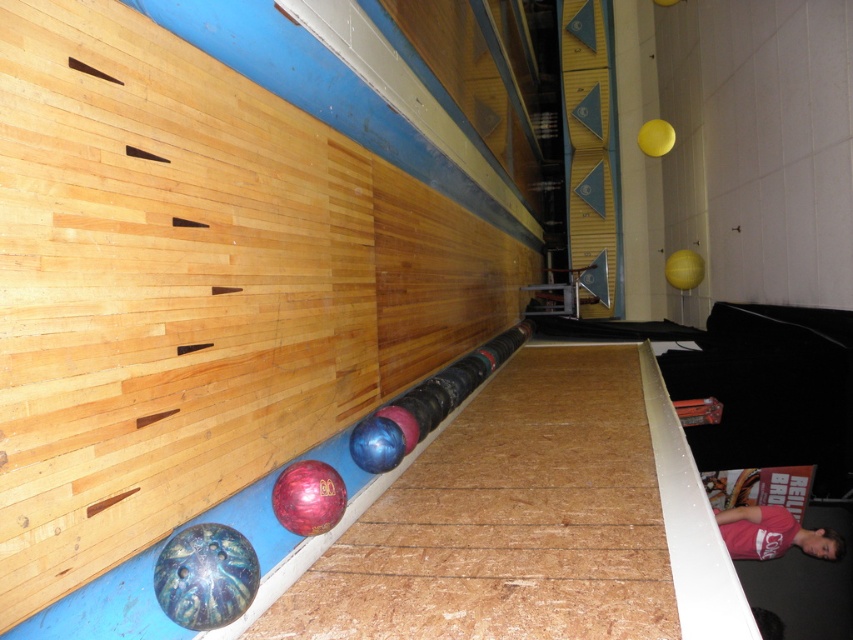
Can you confirm if shiny pink bowling ball at lower center is positioned to the right of blue glossy bowling ball at center?

No, shiny pink bowling ball at lower center is not to the right of blue glossy bowling ball at center.

Based on the photo, is shiny pink bowling ball at lower center thinner than blue glossy bowling ball at center?

Incorrect, shiny pink bowling ball at lower center's width is not less than blue glossy bowling ball at center's.

At what (x,y) coordinates should I click in order to perform the action: click on shiny pink bowling ball at lower center. Please return your answer as a coordinate pair (x, y). Looking at the image, I should click on (308, 497).

Is shiny blue bowling ball at lower left closer to camera compared to shiny pink bowling ball at lower center?

Yes.

Which is in front, point (177, 547) or point (282, 470)?

Point (177, 547) is more forward.

Does point (231, 529) lie behind point (323, 476)?

That is False.

Identify the location of shiny blue bowling ball at lower left. Image resolution: width=853 pixels, height=640 pixels. (206, 577).

Locate an element on the screen. shiny blue bowling ball at lower left is located at coordinates (206, 577).

Which is above, shiny blue bowling ball at lower left or blue glossy bowling ball at center?

Positioned higher is blue glossy bowling ball at center.

Looking at this image, who is more forward, (x=207, y=589) or (x=387, y=428)?

Positioned in front is point (x=207, y=589).

I want to click on shiny blue bowling ball at lower left, so click(206, 577).